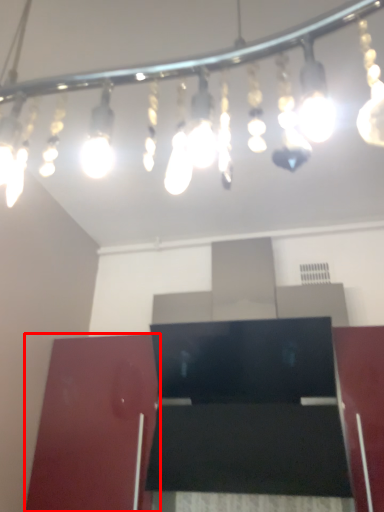
Question: From the image's perspective, what is the correct spatial positioning of furniture (annotated by the red box) in reference to lamp?

Choices:
 (A) below
 (B) above

Answer: (A)